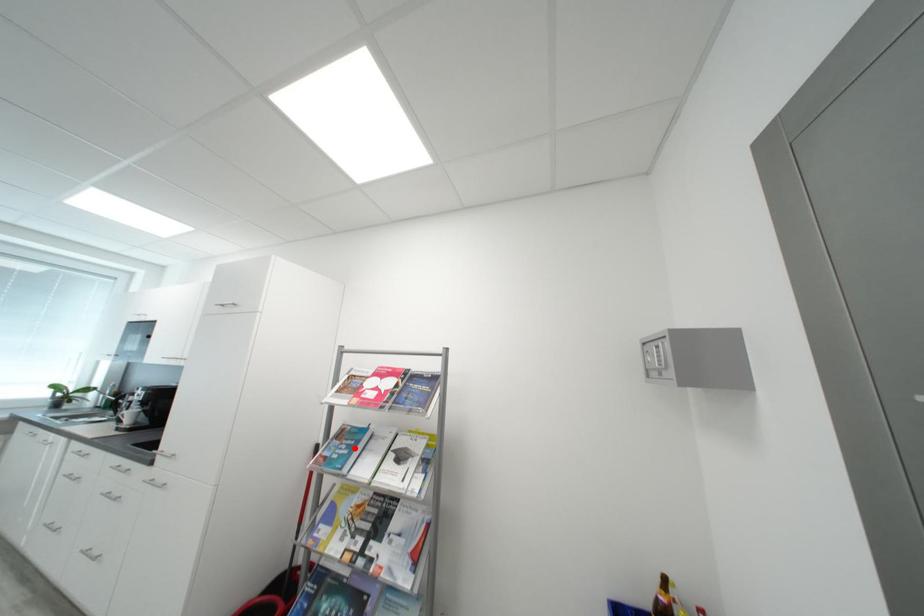
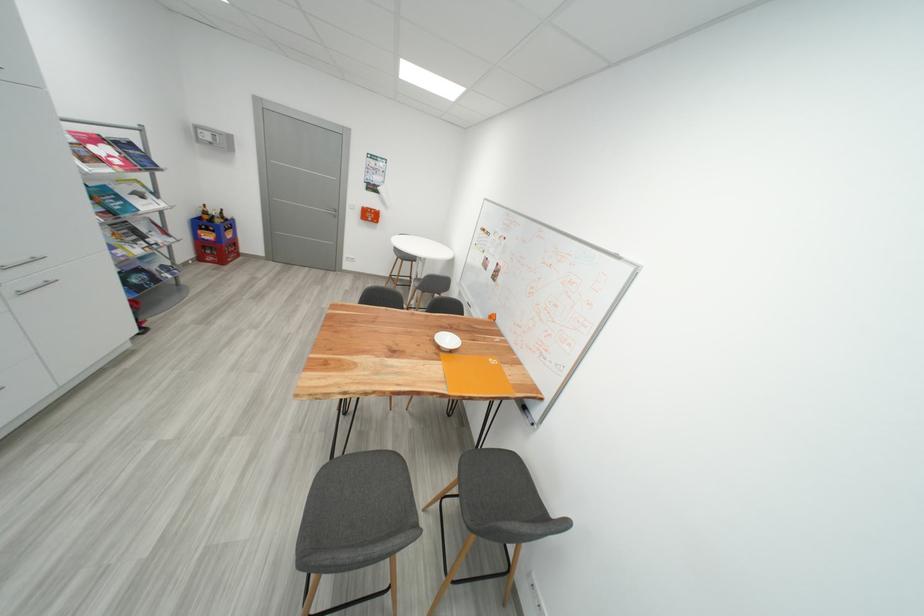
Where in the second image is the point corresponding to the highlighted location from the first image?

(122, 201)